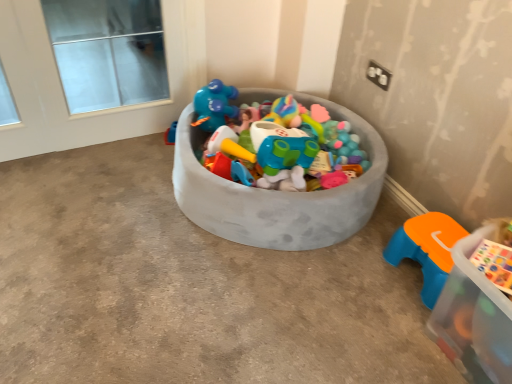
Question: Could you tell me if white glass window at upper left is facing transparent plastic storage box at lower right, which ranks as the 1th storage box in front-to-back order?

Choices:
 (A) yes
 (B) no

Answer: (A)

Question: Considering the relative sizes of white glass window at upper left and transparent plastic storage box at lower right, which ranks as the 1th storage box in front-to-back order, in the image provided, is white glass window at upper left thinner than transparent plastic storage box at lower right, which ranks as the 1th storage box in front-to-back order,?

Choices:
 (A) yes
 (B) no

Answer: (A)

Question: Considering the relative sizes of white glass window at upper left and transparent plastic storage box at lower right, positioned as the second storage box in back-to-front order, in the image provided, is white glass window at upper left bigger than transparent plastic storage box at lower right, positioned as the second storage box in back-to-front order,?

Choices:
 (A) no
 (B) yes

Answer: (B)

Question: Is white glass window at upper left looking in the opposite direction of transparent plastic storage box at lower right, which ranks as the 1th storage box in front-to-back order?

Choices:
 (A) no
 (B) yes

Answer: (A)

Question: Is white glass window at upper left outside transparent plastic storage box at lower right, positioned as the second storage box in back-to-front order?

Choices:
 (A) no
 (B) yes

Answer: (B)

Question: From the image's perspective, is white glass window at upper left on top of transparent plastic storage box at lower right, placed as the second storage box when sorted from left to right?

Choices:
 (A) yes
 (B) no

Answer: (A)

Question: Is textured gray bowl at center, placed as the first storage box when sorted from back to front, positioned with its back to orange plastic stool at lower right?

Choices:
 (A) no
 (B) yes

Answer: (A)

Question: Does textured gray bowl at center, the first storage box from the left, lie in front of orange plastic stool at lower right?

Choices:
 (A) yes
 (B) no

Answer: (A)

Question: Does textured gray bowl at center, placed as the first storage box when sorted from back to front, have a lesser width compared to orange plastic stool at lower right?

Choices:
 (A) yes
 (B) no

Answer: (B)

Question: Considering the relative sizes of textured gray bowl at center, the first storage box from the left, and orange plastic stool at lower right in the image provided, is textured gray bowl at center, the first storage box from the left, bigger than orange plastic stool at lower right?

Choices:
 (A) no
 (B) yes

Answer: (B)

Question: From a real-world perspective, is textured gray bowl at center, which appears as the 2th storage box when viewed from the front, below orange plastic stool at lower right?

Choices:
 (A) no
 (B) yes

Answer: (A)

Question: Could you tell me if textured gray bowl at center, the first storage box from the left, is facing orange plastic stool at lower right?

Choices:
 (A) no
 (B) yes

Answer: (A)

Question: Is orange plastic stool at lower right further to the viewer compared to textured gray bowl at center, the first storage box from the left?

Choices:
 (A) yes
 (B) no

Answer: (A)